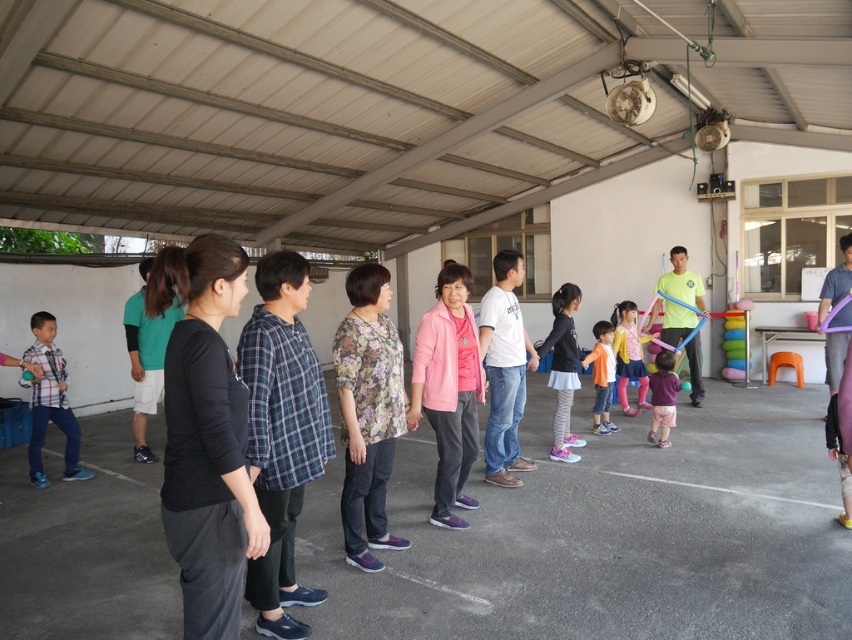
Question: Which object appears closest to the camera in this image?

Choices:
 (A) light pink fabric skirt at center
 (B) white asphalt line at lower center
 (C) orange fabric dress at center

Answer: (B)

Question: Does light pink fabric skirt at center appear on the right side of orange fabric dress at center?

Choices:
 (A) yes
 (B) no

Answer: (B)

Question: Which point appears farthest from the camera in this image?

Choices:
 (A) (608, 428)
 (B) (32, 394)

Answer: (A)

Question: Which object is positioned closest to the plaid fabric shirt at left?

Choices:
 (A) pastel pink leggings at center
 (B) white asphalt line at lower center
 (C) orange fabric dress at center

Answer: (B)

Question: Does pastel pink leggings at center appear on the right side of purple matte dress at center?

Choices:
 (A) yes
 (B) no

Answer: (A)

Question: Is pastel pink leggings at center to the right of white asphalt line at lower center from the viewer's perspective?

Choices:
 (A) no
 (B) yes

Answer: (B)